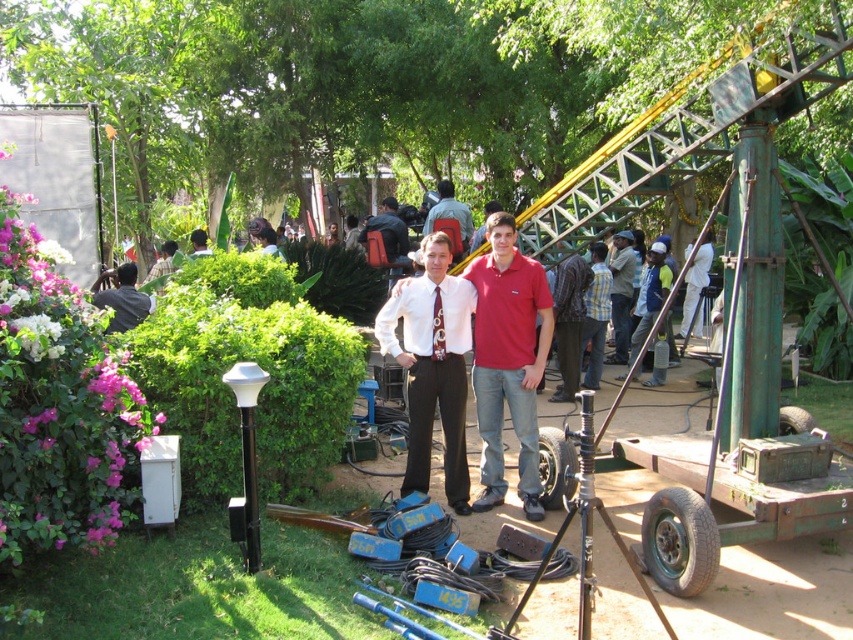
Question: Which of the following is the closest to the observer?

Choices:
 (A) (161, 252)
 (B) (489, 346)
 (C) (628, 301)

Answer: (B)

Question: Is white glossy shirt at center to the right of dark blue jeans at center from the viewer's perspective?

Choices:
 (A) yes
 (B) no

Answer: (B)

Question: Does denim jacket at right have a smaller size compared to green fabric backpack at center?

Choices:
 (A) no
 (B) yes

Answer: (A)

Question: Which point is closer to the camera?

Choices:
 (A) red cotton polo shirt at center
 (B) dark blue jeans at center
 (C) light brown leather jacket at upper center
 (D) dark brown leather jacket at center

Answer: (A)

Question: Does red cotton polo shirt at center appear over dark blue jeans at center?

Choices:
 (A) no
 (B) yes

Answer: (A)

Question: Which object is farther from the camera taking this photo?

Choices:
 (A) denim jacket at right
 (B) dark brown leather jacket at center
 (C) white glossy shirt at center

Answer: (A)